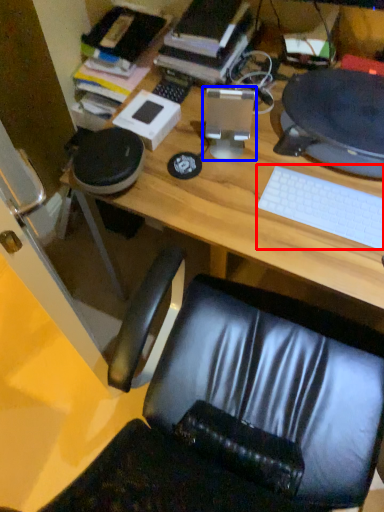
Question: Which object appears farthest to the camera in this image, keyboard (highlighted by a red box) or desktop computer (highlighted by a blue box)?

Choices:
 (A) keyboard
 (B) desktop computer

Answer: (B)